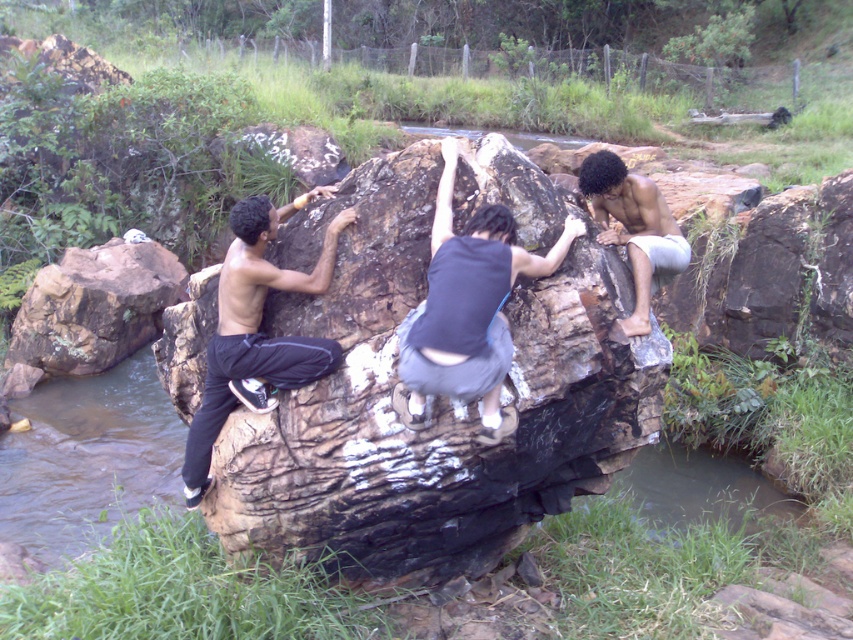
Is point (354, 456) positioned in front of point (486, 339)?

No, (354, 456) is further to viewer.

Between point (395, 300) and point (428, 262), which one is positioned behind?

Point (395, 300)

The width and height of the screenshot is (853, 640). Find the location of `brown rough rock at center`. brown rough rock at center is located at coordinates (437, 396).

Does dark gray fabric pants at center have a greater width compared to black matte pants at left?

Correct, the width of dark gray fabric pants at center exceeds that of black matte pants at left.

Does dark gray fabric pants at center appear on the left side of black matte pants at left?

Incorrect, dark gray fabric pants at center is not on the left side of black matte pants at left.

Is point (486, 294) behind point (201, 470)?

No.

The width and height of the screenshot is (853, 640). In order to click on dark gray fabric pants at center in this screenshot , I will do `click(468, 308)`.

Does brown rough rock at center have a greater height compared to smooth gray shorts at right?

Correct, brown rough rock at center is much taller as smooth gray shorts at right.

Does brown rough rock at center come in front of smooth gray shorts at right?

Yes, brown rough rock at center is closer to the viewer.

Describe the element at coordinates (437, 396) in the screenshot. The width and height of the screenshot is (853, 640). I see `brown rough rock at center` at that location.

The width and height of the screenshot is (853, 640). What are the coordinates of `brown rough rock at center` in the screenshot? It's located at (437, 396).